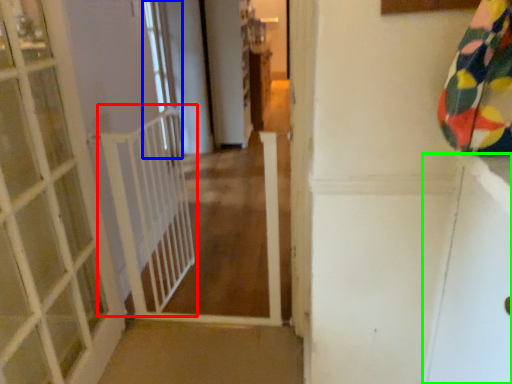
Question: Based on their relative distances, which object is nearer to balustrade (highlighted by a red box)? Choose from window (highlighted by a blue box) and screen door (highlighted by a green box).

Choices:
 (A) window
 (B) screen door

Answer: (B)